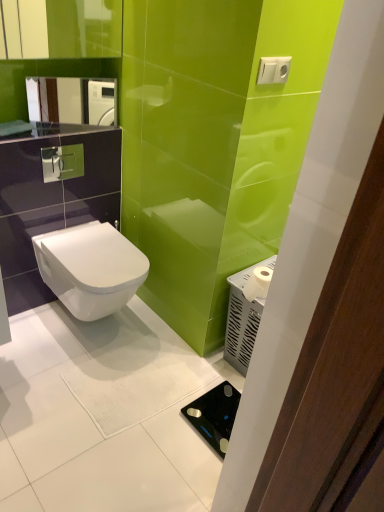
What are the coordinates of `vacant space underneath white glossy toilet at center (from a real-world perspective)` in the screenshot? It's located at (110, 332).